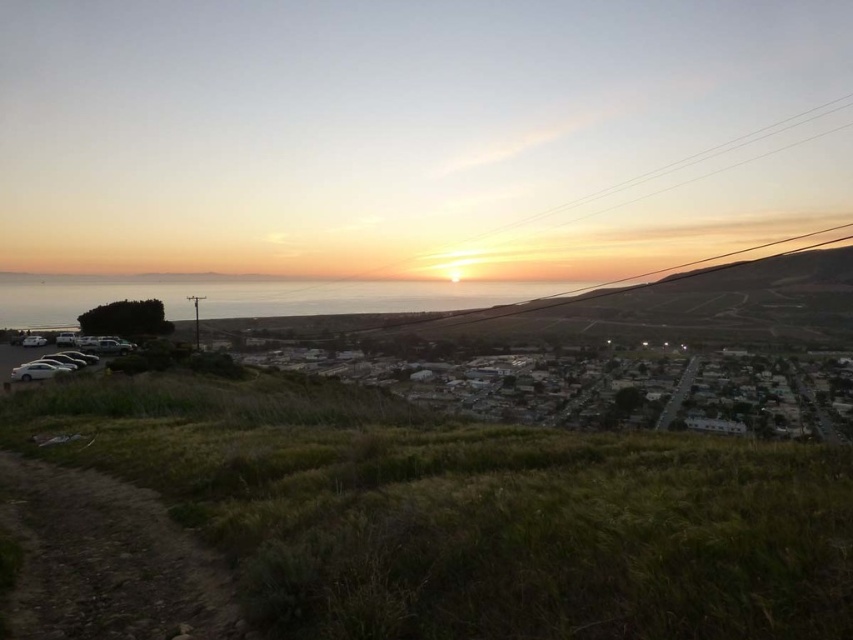
Between green grassy hillside at lower left and metallic wire at center, which one is positioned higher?

metallic wire at center is higher up.

Can you confirm if green grassy hillside at lower left is bigger than metallic wire at center?

Actually, green grassy hillside at lower left might be smaller than metallic wire at center.

Is point (628, 609) closer to camera compared to point (581, 216)?

Yes, it is.

Locate an element on the screen. This screenshot has height=640, width=853. green grassy hillside at lower left is located at coordinates (466, 513).